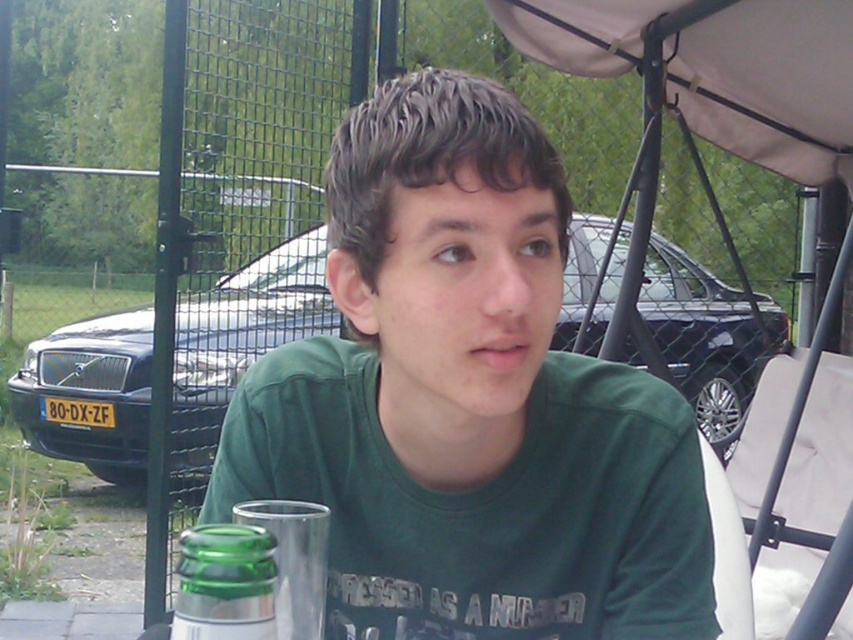
You are standing 30 inches away from the point at coordinates point (352, 541). Can you reach it without moving your feet?

The distance of point (352, 541) from viewer is 32.74 inches. Since you are 30 inches away from it, you are still 2.74 inches away and cannot reach it without moving your feet.

Based on the scene description, where is the green matte shirt at center located in terms of its 2D coordinates?

The green matte shirt at center is located at the 2D coordinates of point (468, 401).